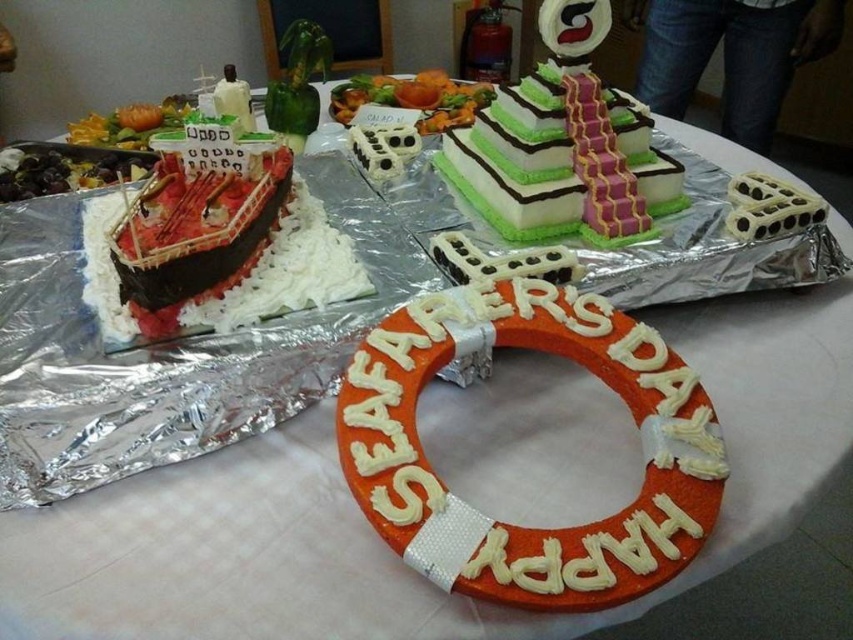
In the scene shown: You are a guest at a party and see the chocolate fondant boat at left and the green leafy salad at center. Which one is positioned lower on the table?

The chocolate fondant boat at left is positioned lower on the table than the green leafy salad at center because it is below it.

Consider the image. You are a guest at a party and want to take a photo of both the orange fondant life belt at center and the green leafy salad at center. Since you want them to appear in the same frame, which one should you focus on first to ensure both are visible?

You should focus on the orange fondant life belt at center first because it is located below the green leafy salad at center, so positioning your camera to include the lower area where the life belt is will naturally capture the salad above it as well.

Based on the scene description, where exactly is the orange fondant life belt at center located in terms of coordinates?

The orange fondant life belt at center is located at coordinates point (x=515, y=525).